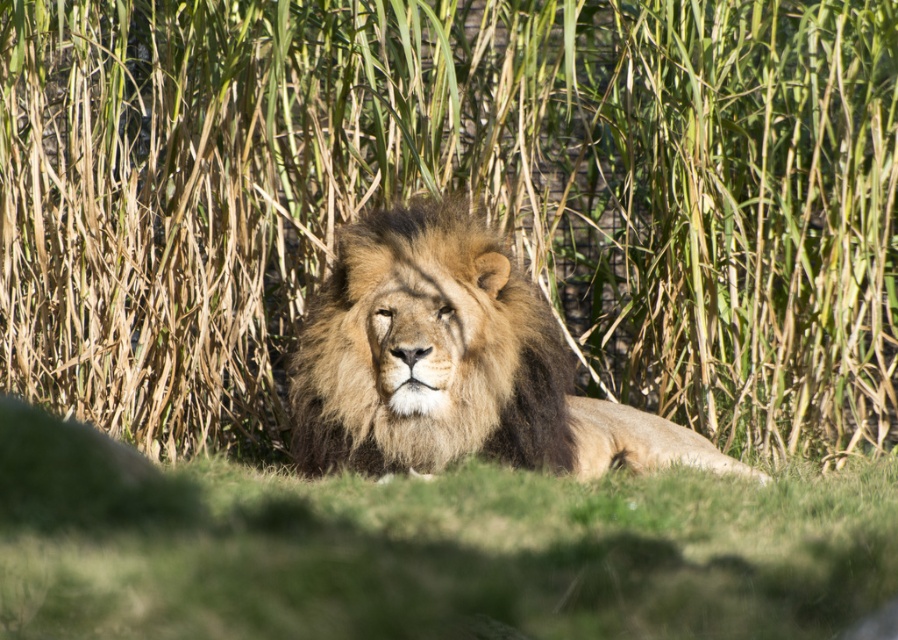
You are a photographer who wants to capture a closeup of the green soft grass at center without the golden fur lion at center blocking the view. Based on the scene description, can you position yourself so that the lion is completely out of the frame?

The green soft grass at center is in front of the golden fur lion at center, so the lion is behind the grass. Therefore, positioning yourself to focus on the grass would still show the lion behind it. To completely exclude the lion from the frame, you would need to adjust your angle or move closer to the grass so that the lion is out of the camera view.

Based on the photo, you are a photographer who wants to capture a closeup of the golden fur lion at center without getting too close to it. The camera you have can focus on objects within 30 inches. Is the green soft grass at center too close to the lion for your camera to focus properly?

The green soft grass at center is 32.94 inches away from the golden fur lion at center. Since the camera can focus within 30 inches, the distance between them is beyond the camera focus range. Therefore, the camera can focus on the golden fur lion at center without interference from the grass.

You are a photographer who wants to capture a closeup of the golden fur lion at center without the green soft grass at center showing in the background. Is the current camera setup with a shallow depth of field suitable for this?

The green soft grass at center is positioned under golden fur lion at center, so the shallow depth of field would blur the grass beneath the lion, making it suitable for capturing a closeup of the golden fur lion at center without the grass showing clearly in the background.